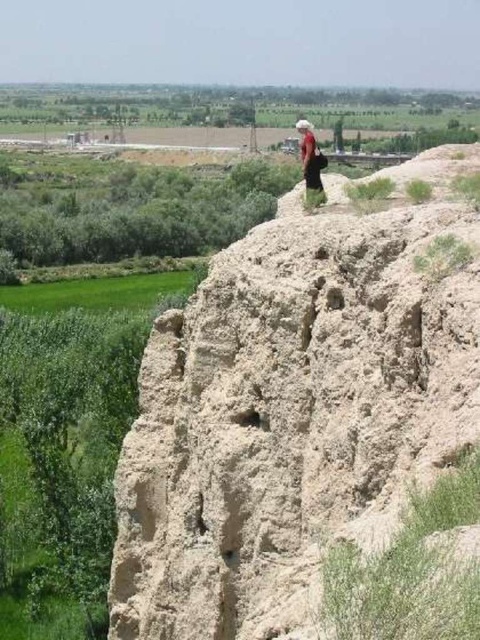
Question: From the image, what is the correct spatial relationship of light beige rough rock at center in relation to matte red dress at center?

Choices:
 (A) above
 (B) below

Answer: (B)

Question: Can you confirm if light beige rough rock at center is positioned to the left of matte red dress at center?

Choices:
 (A) yes
 (B) no

Answer: (A)

Question: Which point is farther to the camera?

Choices:
 (A) light beige rough rock at center
 (B) matte red dress at center

Answer: (B)

Question: Does light beige rough rock at center appear under matte red dress at center?

Choices:
 (A) yes
 (B) no

Answer: (A)

Question: Among these points, which one is nearest to the camera?

Choices:
 (A) (319, 148)
 (B) (186, 461)

Answer: (B)

Question: Which point is farther to the camera?

Choices:
 (A) (314, 138)
 (B) (236, 548)

Answer: (A)